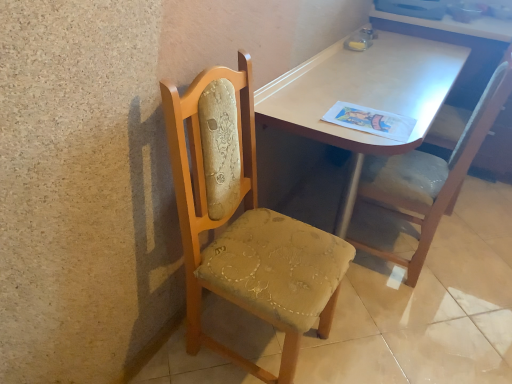
You are a GUI agent. You are given a task and a screenshot of the screen. Output one action in this format:
    pyautogui.click(x=<x>, y=<y>)
    Task: Click on the vacant point to the right of velvet upholstered chair at right, the second chair when ordered from left to right
    
    Given the screenshot: What is the action you would take?
    pyautogui.click(x=468, y=265)